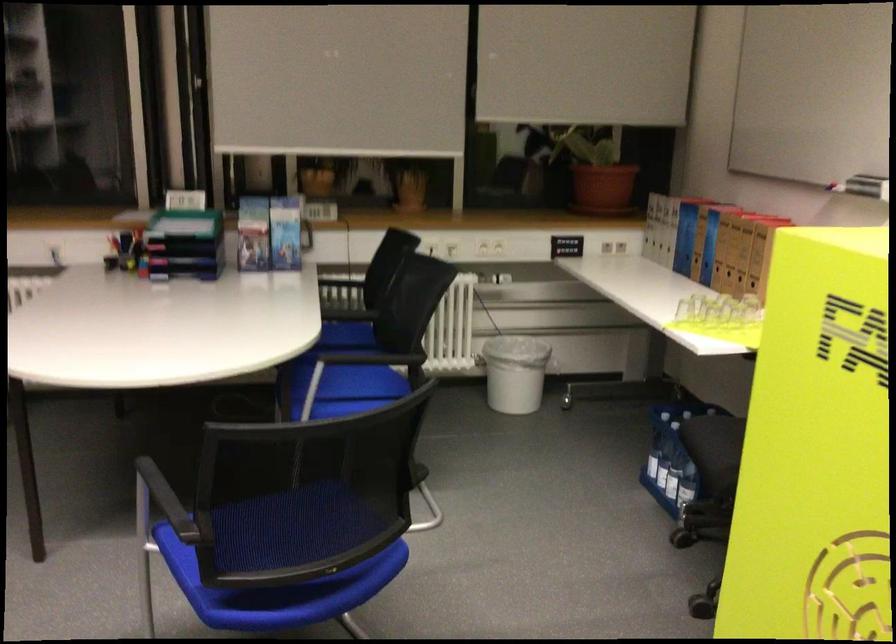
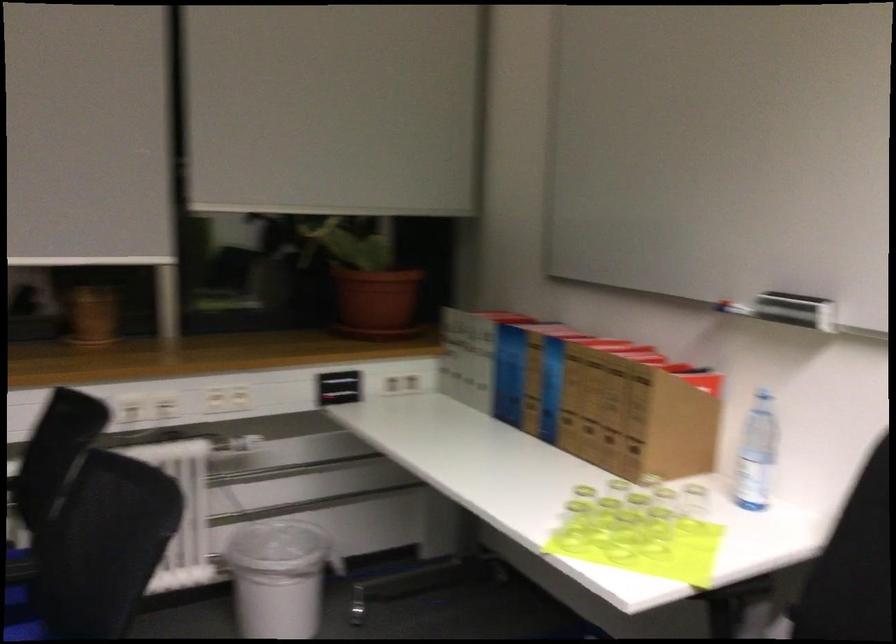
In the second image, find the point that corresponds to point (566, 243) in the first image.

(339, 386)